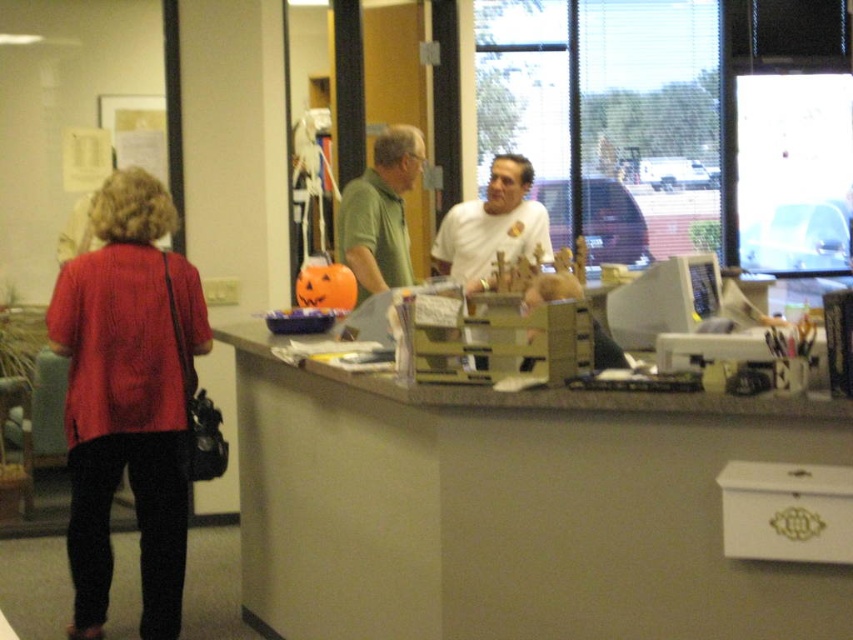
Who is positioned more to the left, matte gray desk at center or white matte shirt at center?

From the viewer's perspective, matte gray desk at center appears more on the left side.

Who is lower down, matte gray desk at center or white matte shirt at center?

matte gray desk at center is lower down.

What do you see at coordinates (511, 509) in the screenshot? I see `matte gray desk at center` at bounding box center [511, 509].

This screenshot has height=640, width=853. I want to click on matte gray desk at center, so click(x=511, y=509).

Which is in front, point (413, 422) or point (178, 403)?

Positioned in front is point (413, 422).

Is matte gray desk at center positioned behind matte red blouse at left?

No, it is in front of matte red blouse at left.

What do you see at coordinates (511, 509) in the screenshot? I see `matte gray desk at center` at bounding box center [511, 509].

The height and width of the screenshot is (640, 853). I want to click on matte gray desk at center, so click(511, 509).

Can you confirm if matte red blouse at left is positioned to the left of white matte shirt at center?

Yes, matte red blouse at left is to the left of white matte shirt at center.

Can you confirm if matte red blouse at left is positioned to the right of white matte shirt at center?

Incorrect, matte red blouse at left is not on the right side of white matte shirt at center.

Locate an element on the screen. Image resolution: width=853 pixels, height=640 pixels. matte red blouse at left is located at coordinates (126, 397).

The height and width of the screenshot is (640, 853). I want to click on matte red blouse at left, so click(126, 397).